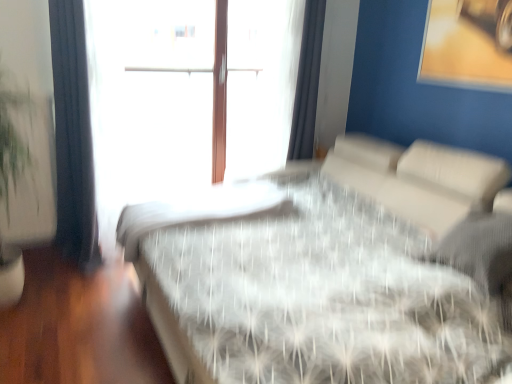
Where is `white sheer curtain at upper right, the 2th curtain viewed from the front`? This screenshot has height=384, width=512. white sheer curtain at upper right, the 2th curtain viewed from the front is located at coordinates (307, 82).

Describe the element at coordinates (195, 210) in the screenshot. I see `white textured mattress at center` at that location.

At what (x,y) coordinates should I click in order to perform the action: click on white sheer curtain at upper right, which is counted as the second curtain, starting from the left. Please return your answer as a coordinate pair (x, y). This screenshot has height=384, width=512. Looking at the image, I should click on 307,82.

Is white textured bed at center looking in the opposite direction of white sheer curtain at upper right, placed as the first curtain when sorted from back to front?

No.

Based on the photo, from the image's perspective, is white textured bed at center located above or below white sheer curtain at upper right, the 2th curtain viewed from the front?

Based on their image positions, white textured bed at center is located beneath white sheer curtain at upper right, the 2th curtain viewed from the front.

Are white textured bed at center and white sheer curtain at upper right, arranged as the 1th curtain when viewed from the right, beside each other?

white textured bed at center and white sheer curtain at upper right, arranged as the 1th curtain when viewed from the right, are clearly separated.

Who is taller, white textured bed at center or white sheer curtain at upper right, the 2th curtain viewed from the front?

Standing taller between the two is white sheer curtain at upper right, the 2th curtain viewed from the front.

Between white textured bed at center and dark blue fabric curtain at left, the second curtain from the right, which one has larger width?

With larger width is white textured bed at center.

Considering the positions of points (241, 347) and (54, 41), is point (241, 347) farther from camera compared to point (54, 41)?

No, it is in front of (54, 41).

In the image, is white textured bed at center positioned in front of or behind dark blue fabric curtain at left, placed as the first curtain when sorted from left to right?

In the image, white textured bed at center appears in front of dark blue fabric curtain at left, placed as the first curtain when sorted from left to right.

Looking at this image, between white textured bed at center and dark blue fabric curtain at left, which appears as the second curtain when viewed from the back, which one has smaller size?

dark blue fabric curtain at left, which appears as the second curtain when viewed from the back.

Is dark blue fabric curtain at left, which appears as the first curtain when viewed from the front, at the left side of white sheer curtain at upper right, which is counted as the second curtain, starting from the left?

Yes.

Based on their sizes in the image, would you say dark blue fabric curtain at left, which appears as the first curtain when viewed from the front, is bigger or smaller than white sheer curtain at upper right, the 2th curtain viewed from the front?

Clearly, dark blue fabric curtain at left, which appears as the first curtain when viewed from the front, is larger in size than white sheer curtain at upper right, the 2th curtain viewed from the front.

Is dark blue fabric curtain at left, which appears as the second curtain when viewed from the back, positioned far away from white sheer curtain at upper right, arranged as the 1th curtain when viewed from the right?

Yes, dark blue fabric curtain at left, which appears as the second curtain when viewed from the back, and white sheer curtain at upper right, arranged as the 1th curtain when viewed from the right, are quite far apart.

Which is nearer, (83, 7) or (309, 43)?

Point (83, 7) appears to be closer to the viewer than point (309, 43).

From a real-world perspective, does white sheer curtain at upper right, which is counted as the second curtain, starting from the left, stand above white textured mattress at center?

Yes, from a real-world perspective, white sheer curtain at upper right, which is counted as the second curtain, starting from the left, is over white textured mattress at center

Are white sheer curtain at upper right, arranged as the 1th curtain when viewed from the right, and white textured mattress at center located far from each other?

No.

Is white sheer curtain at upper right, arranged as the 1th curtain when viewed from the right, inside the boundaries of white textured mattress at center, or outside?

white sheer curtain at upper right, arranged as the 1th curtain when viewed from the right, is located beyond the bounds of white textured mattress at center.

Is white textured bed at center far from white textured mattress at center?

They are positioned close to each other.

Is white textured bed at center wider than white textured mattress at center?

Indeed, white textured bed at center has a greater width compared to white textured mattress at center.

Considering the relative positions of white textured bed at center and white textured mattress at center in the image provided, is white textured bed at center to the right of white textured mattress at center from the viewer's perspective?

Correct, you'll find white textured bed at center to the right of white textured mattress at center.

Is white textured bed at center situated inside white textured mattress at center or outside?

white textured bed at center is outside white textured mattress at center.

Which object is wider, white textured mattress at center or white sheer curtain at upper right, which is counted as the second curtain, starting from the left?

With larger width is white textured mattress at center.

Between white textured mattress at center and white sheer curtain at upper right, placed as the first curtain when sorted from back to front, which one appears on the left side from the viewer's perspective?

Positioned to the left is white textured mattress at center.

Could you measure the distance between white textured mattress at center and dark blue fabric curtain at left, the second curtain from the right?

24.68 inches.

In the scene shown: Are white textured mattress at center and dark blue fabric curtain at left, placed as the first curtain when sorted from left to right, far apart?

No, white textured mattress at center is not far away from dark blue fabric curtain at left, placed as the first curtain when sorted from left to right.

Is white textured mattress at center completely or partially outside of dark blue fabric curtain at left, placed as the first curtain when sorted from left to right?

Yes, white textured mattress at center is located beyond the bounds of dark blue fabric curtain at left, placed as the first curtain when sorted from left to right.

Is white textured mattress at center facing towards dark blue fabric curtain at left, the second curtain from the right?

No, white textured mattress at center is not aimed at dark blue fabric curtain at left, the second curtain from the right.

Locate an element on the screen. The height and width of the screenshot is (384, 512). bed lying in front of the white sheer curtain at upper right, arranged as the 1th curtain when viewed from the right is located at coordinates (326, 272).

Which curtain is the 1st one when counting from the back of the white textured bed at center? Please provide its 2D coordinates.

[(73, 136)]

When comparing their distances from white textured bed at center, does white textured mattress at center or dark blue fabric curtain at left, the second curtain from the right, seem further?

dark blue fabric curtain at left, the second curtain from the right, is further to white textured bed at center.

In the scene shown: When comparing their distances from white textured bed at center, does white sheer curtain at upper right, which is counted as the second curtain, starting from the left, or dark blue fabric curtain at left, which appears as the first curtain when viewed from the front, seem further?

The object further to white textured bed at center is dark blue fabric curtain at left, which appears as the first curtain when viewed from the front.

Estimate the real-world distances between objects in this image. Which object is closer to white textured bed at center, dark blue fabric curtain at left, which appears as the first curtain when viewed from the front, or white textured mattress at center?

white textured mattress at center lies closer to white textured bed at center than the other object.

When comparing their distances from white sheer curtain at upper right, which is counted as the second curtain, starting from the left, does white textured mattress at center or dark blue fabric curtain at left, which appears as the second curtain when viewed from the back, seem further?

dark blue fabric curtain at left, which appears as the second curtain when viewed from the back, is further to white sheer curtain at upper right, which is counted as the second curtain, starting from the left.

Considering their positions, is white textured mattress at center positioned further to white sheer curtain at upper right, the 2th curtain viewed from the front, than white textured bed at center?

white textured bed at center is further to white sheer curtain at upper right, the 2th curtain viewed from the front.

Looking at the image, which one is located further to dark blue fabric curtain at left, the second curtain from the right, white textured bed at center or white sheer curtain at upper right, placed as the first curtain when sorted from back to front?

The object further to dark blue fabric curtain at left, the second curtain from the right, is white sheer curtain at upper right, placed as the first curtain when sorted from back to front.

When comparing their distances from white sheer curtain at upper right, the 2th curtain viewed from the front, does white textured bed at center or dark blue fabric curtain at left, placed as the first curtain when sorted from left to right, seem closer?

The object closer to white sheer curtain at upper right, the 2th curtain viewed from the front, is white textured bed at center.

Looking at the image, which one is located further to white textured mattress at center, dark blue fabric curtain at left, which appears as the first curtain when viewed from the front, or white textured bed at center?

Based on the image, dark blue fabric curtain at left, which appears as the first curtain when viewed from the front, appears to be further to white textured mattress at center.

Where is `mattress between white textured bed at center and white sheer curtain at upper right, arranged as the 1th curtain when viewed from the right, along the z-axis`? This screenshot has width=512, height=384. mattress between white textured bed at center and white sheer curtain at upper right, arranged as the 1th curtain when viewed from the right, along the z-axis is located at coordinates (195, 210).

I want to click on curtain between white textured bed at center and white sheer curtain at upper right, the 2th curtain viewed from the front, in the front-back direction, so click(x=73, y=136).

This screenshot has height=384, width=512. Identify the location of mattress located between white textured bed at center and dark blue fabric curtain at left, placed as the first curtain when sorted from left to right, in the depth direction. (195, 210).

This screenshot has height=384, width=512. What are the coordinates of `mattress situated between dark blue fabric curtain at left, which appears as the first curtain when viewed from the front, and white sheer curtain at upper right, arranged as the 1th curtain when viewed from the right, from left to right` in the screenshot? It's located at (195, 210).